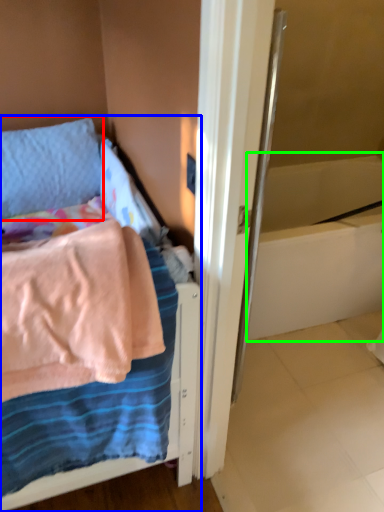
Question: Based on their relative distances, which object is nearer to pillow (highlighted by a red box)? Choose from bed (highlighted by a blue box) and bath (highlighted by a green box).

Choices:
 (A) bed
 (B) bath

Answer: (A)